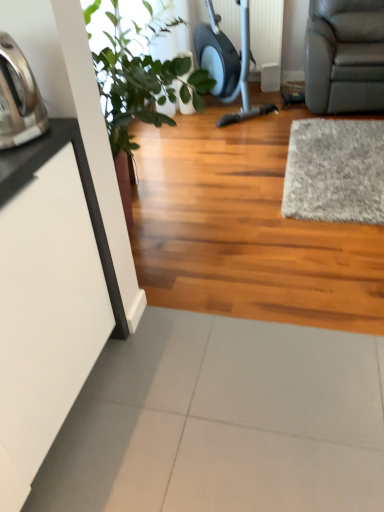
Question: Is green leafy plant at upper left at the left side of brushed metal kettle at left?

Choices:
 (A) yes
 (B) no

Answer: (B)

Question: Considering the relative sizes of green leafy plant at upper left and brushed metal kettle at left in the image provided, is green leafy plant at upper left smaller than brushed metal kettle at left?

Choices:
 (A) no
 (B) yes

Answer: (A)

Question: Considering the relative sizes of green leafy plant at upper left and brushed metal kettle at left in the image provided, is green leafy plant at upper left taller than brushed metal kettle at left?

Choices:
 (A) yes
 (B) no

Answer: (A)

Question: From the image's perspective, does green leafy plant at upper left appear lower than brushed metal kettle at left?

Choices:
 (A) yes
 (B) no

Answer: (B)

Question: Is green leafy plant at upper left touching brushed metal kettle at left?

Choices:
 (A) yes
 (B) no

Answer: (B)

Question: From the image's perspective, is brushed metal kettle at left located above or below green leafy plant at upper left?

Choices:
 (A) below
 (B) above

Answer: (A)

Question: Considering the relative positions of brushed metal kettle at left and green leafy plant at upper left in the image provided, is brushed metal kettle at left to the left or to the right of green leafy plant at upper left?

Choices:
 (A) right
 (B) left

Answer: (B)

Question: Looking at their shapes, would you say brushed metal kettle at left is wider or thinner than green leafy plant at upper left?

Choices:
 (A) wide
 (B) thin

Answer: (B)

Question: Considering the positions of brushed metal kettle at left and green leafy plant at upper left in the image, is brushed metal kettle at left taller or shorter than green leafy plant at upper left?

Choices:
 (A) tall
 (B) short

Answer: (B)

Question: Considering their positions, is green leafy plant at upper left located in front of or behind brushed metal kettle at left?

Choices:
 (A) behind
 (B) front

Answer: (A)

Question: Is green leafy plant at upper left wider or thinner than brushed metal kettle at left?

Choices:
 (A) wide
 (B) thin

Answer: (A)

Question: In terms of height, does green leafy plant at upper left look taller or shorter compared to brushed metal kettle at left?

Choices:
 (A) short
 (B) tall

Answer: (B)

Question: From the image's perspective, is green leafy plant at upper left located above or below brushed metal kettle at left?

Choices:
 (A) below
 (B) above

Answer: (B)

Question: In the image, is brushed metal kettle at left positioned in front of or behind gray shaggy rug at right?

Choices:
 (A) front
 (B) behind

Answer: (A)

Question: Based on their sizes in the image, would you say brushed metal kettle at left is bigger or smaller than gray shaggy rug at right?

Choices:
 (A) small
 (B) big

Answer: (A)